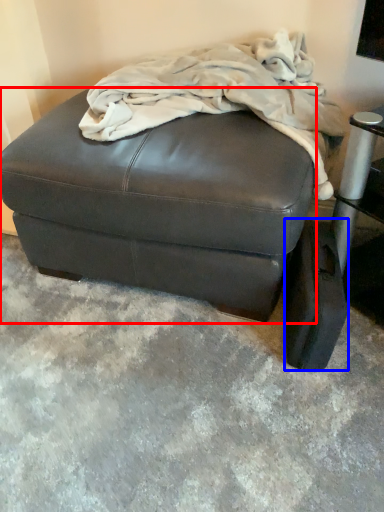
Question: Which of the following is the farthest to the observer, furniture (highlighted by a red box) or pad (highlighted by a blue box)?

Choices:
 (A) furniture
 (B) pad

Answer: (B)